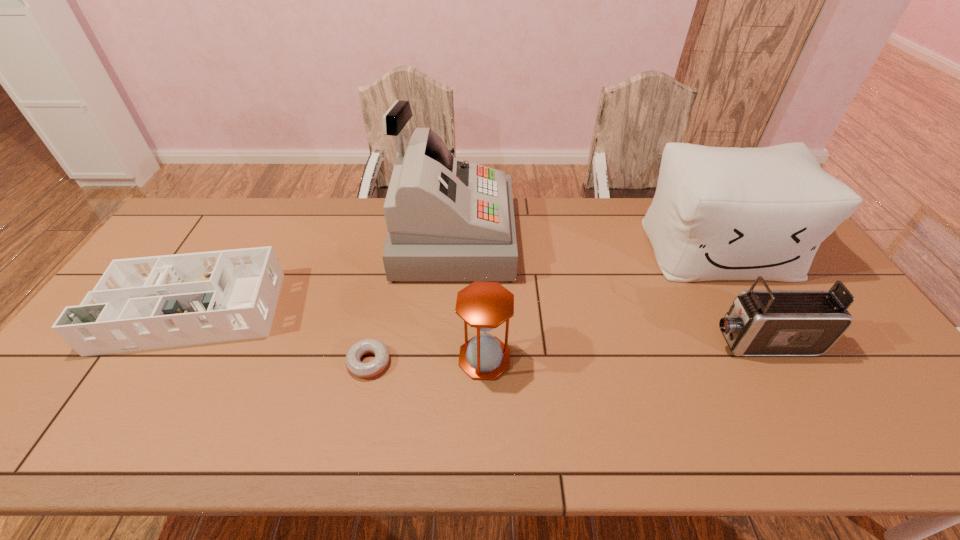
Image resolution: width=960 pixels, height=540 pixels. Identify the location of free spot between the tallest object and the fifth tallest object. (326, 272).

What are the coordinates of `the fifth closest object relative to the camcorder` in the screenshot? It's located at (143, 303).

Identify which object is located as the fourth nearest to the fifth shortest object. Please provide its 2D coordinates. Your answer should be formatted as a tuple, i.e. [(x, y)], where the tuple contains the x and y coordinates of a point satisfying the conditions above.

[(360, 369)]

I want to click on vacant area in the image that satisfies the following two spatial constraints: 1. on the keypad side of the tallest object; 2. on the right side of the hourglass, so click(444, 359).

At what (x,y) coordinates should I click in order to perform the action: click on vacant space that satisfies the following two spatial constraints: 1. on the keypad side of the cash register; 2. on the back side of the hourglass. Please return your answer as a coordinate pair (x, y). Image resolution: width=960 pixels, height=540 pixels. Looking at the image, I should click on (444, 359).

At what (x,y) coordinates should I click in order to perform the action: click on free spot that satisfies the following two spatial constraints: 1. on the keypad side of the tallest object; 2. on the front side of the shortest object. Please return your answer as a coordinate pair (x, y). Looking at the image, I should click on (444, 362).